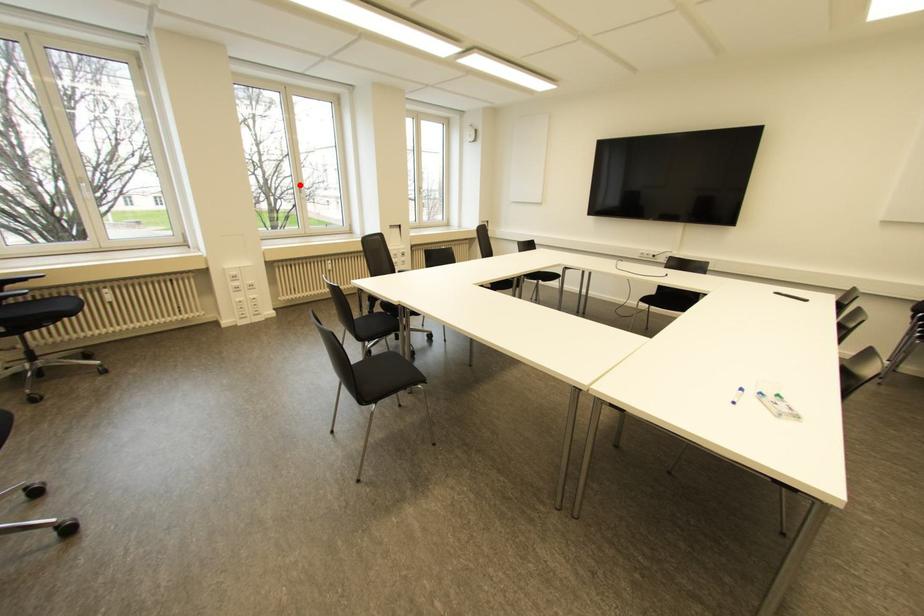
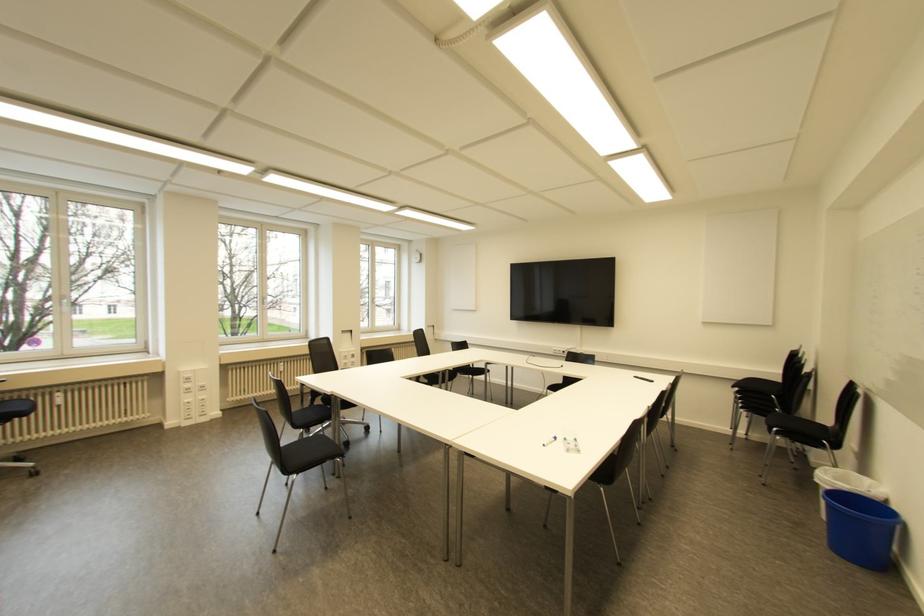
Locate, in the second image, the point that corresponds to the highlighted location in the first image.

(263, 298)